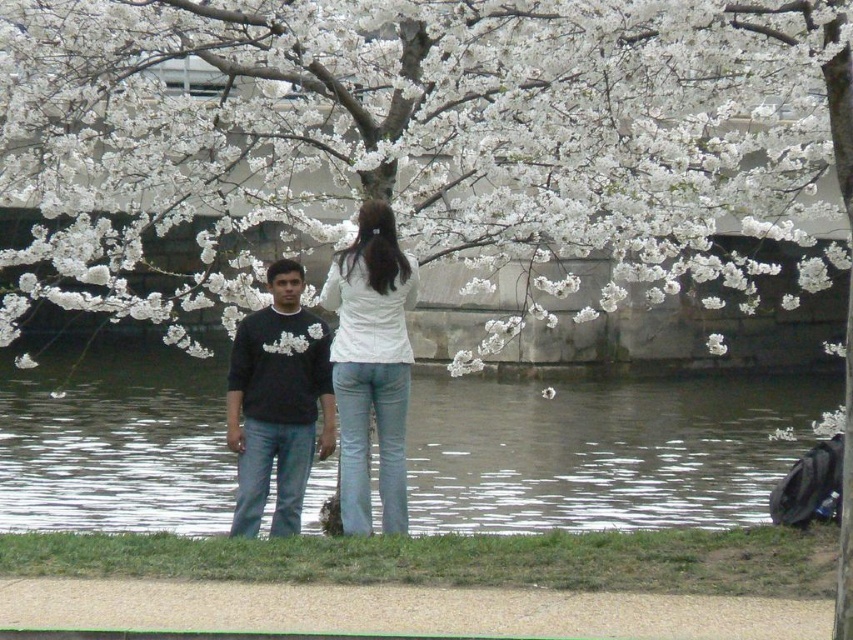
You are a photographer aiming to capture both the white matte shirt at center and the black matte sweater at center in a single shot. Based on their positions, which clothing item will appear closer to the top of the photo?

The white matte shirt at center will appear closer to the top of the photo because it is taller than the black matte sweater at center.

You are a photographer trying to capture the white blossoms at center in your shot. If you want to frame them precisely at the center of your viewfinder, which has a crosshair at coordinates 0.5, 0.5, should you move your camera left or right?

The white blossoms at center are located at 0.198 on the x coordinate, which is to the left of the viewfinder center at 0.5. Therefore, you should move the camera to the right to center them.